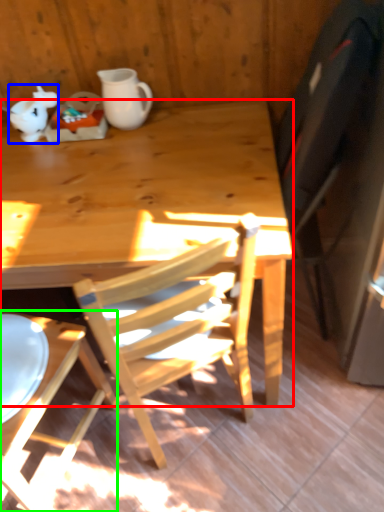
Question: Considering the real-world distances, which object is closest to desk (highlighted by a red box)? teapot (highlighted by a blue box) or chair (highlighted by a green box).

Choices:
 (A) teapot
 (B) chair

Answer: (B)